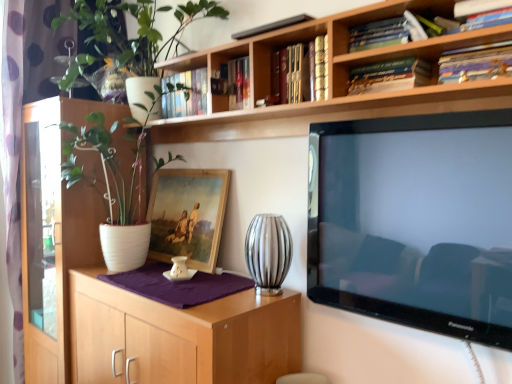
The image size is (512, 384). Identify the location of vacant space in front of silver metallic vase at center. (247, 304).